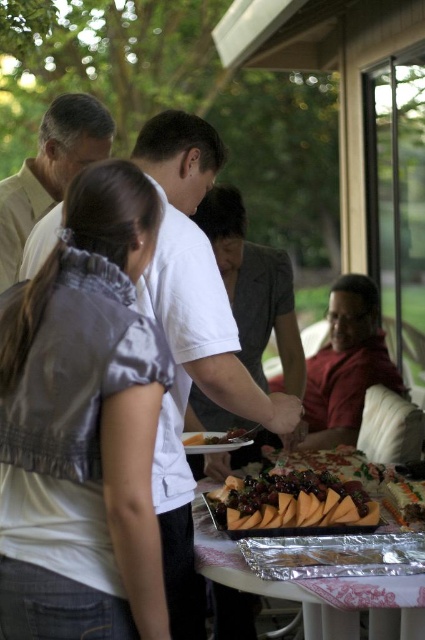
What is the color of the shirt of the person at the position marked by point (50, 172)?

The person at the position marked by point (50, 172) is wearing a light brown shirt.

You are a photographer trying to capture a candid shot of the two people wearing the gray satin blouse at center and the matte gray dress at center. The camera you are using has a maximum focus range of 3 feet. Can you capture both subjects in focus without moving the camera or the subjects?

The gray satin blouse at center is 3.55 feet from the matte gray dress at center. Since the camera can only focus within 3 feet, the distance between them exceeds the camera s maximum focus range. Therefore, you cannot capture both subjects in focus without adjusting the camera or moving the subjects.